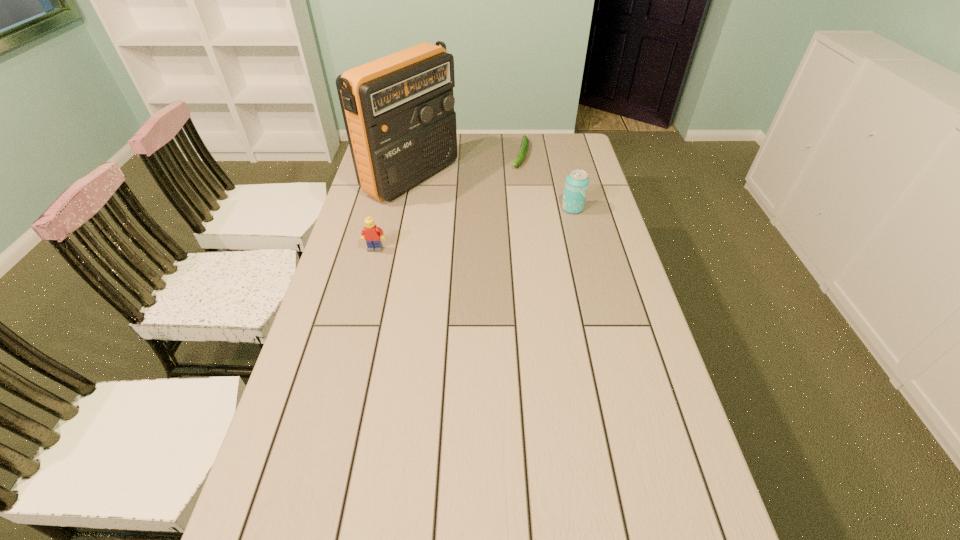
Where is `free space at the near edge of the desktop`? This screenshot has height=540, width=960. free space at the near edge of the desktop is located at coordinates (501, 509).

You are a GUI agent. You are given a task and a screenshot of the screen. Output one action in this format:
    pyautogui.click(x=<x>, y=<y>)
    Task: Click on the free space at the left edge of the desktop
    The image size is (960, 540).
    Given the screenshot: What is the action you would take?
    pyautogui.click(x=347, y=266)

Image resolution: width=960 pixels, height=540 pixels. Find the location of `vacant region at the right edge of the desktop`. vacant region at the right edge of the desktop is located at coordinates (632, 440).

The height and width of the screenshot is (540, 960). In order to click on empty space between the beer can and the tallest object in this screenshot , I will do `click(492, 193)`.

Locate an element on the screen. free spot between the nearest object and the rightmost object is located at coordinates (474, 228).

Locate an element on the screen. vacant point located between the Lego and the third object from left to right is located at coordinates (448, 202).

Where is `free spot between the rightmost object and the tallest object`? The height and width of the screenshot is (540, 960). free spot between the rightmost object and the tallest object is located at coordinates (492, 193).

Find the location of a particular element. This screenshot has height=540, width=960. empty space between the nearest object and the radio receiver is located at coordinates (393, 213).

Where is `vacant area that lies between the Lego and the rightmost object`? This screenshot has height=540, width=960. vacant area that lies between the Lego and the rightmost object is located at coordinates (474, 228).

Where is `blank region between the rightmost object and the shortest object`? This screenshot has width=960, height=540. blank region between the rightmost object and the shortest object is located at coordinates (546, 181).